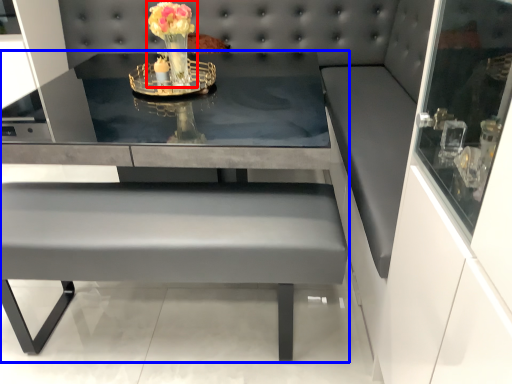
Question: Among these objects, which one is nearest to the camera, floral arrangement (highlighted by a red box) or table (highlighted by a blue box)?

Choices:
 (A) floral arrangement
 (B) table

Answer: (B)